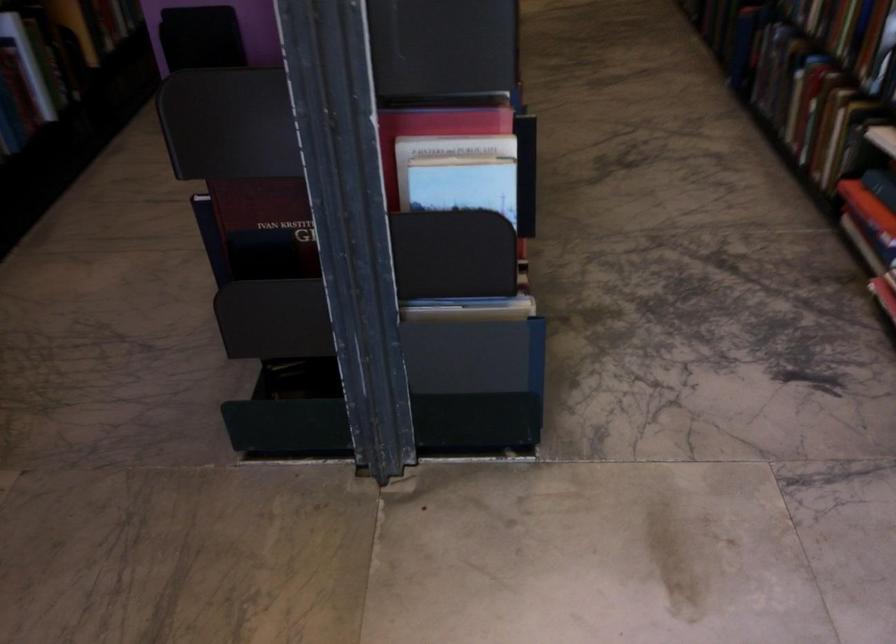
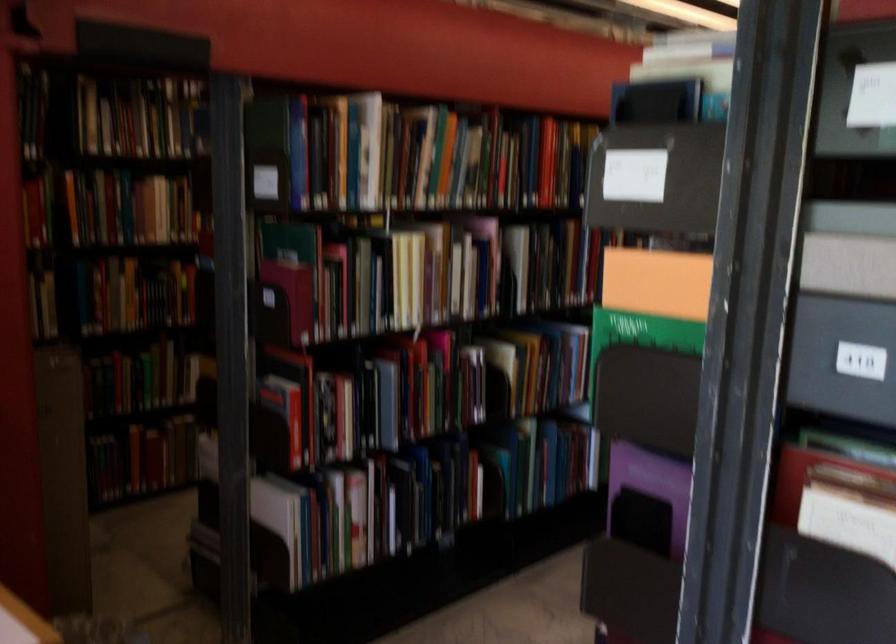
Question: The camera is either moving clockwise (left) or counter-clockwise (right) around the object. The first image is from the beginning of the video and the second image is from the end. Is the camera moving left or right when shooting the video?

Choices:
 (A) Left
 (B) Right

Answer: (B)